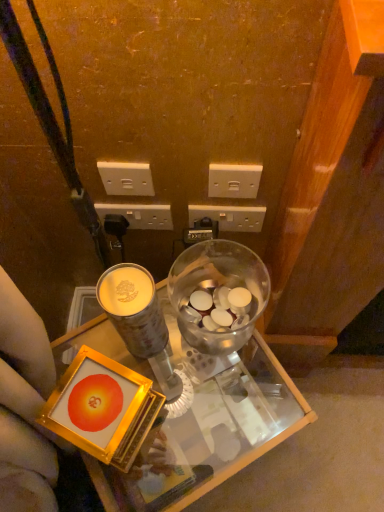
Question: Is white plastic power outlet at center, the second power outlet from the right, bigger than transparent glass desk at center?

Choices:
 (A) yes
 (B) no

Answer: (B)

Question: Considering the relative sizes of white plastic power outlet at center, which is the third power outlet from left to right, and transparent glass desk at center in the image provided, is white plastic power outlet at center, which is the third power outlet from left to right, smaller than transparent glass desk at center?

Choices:
 (A) no
 (B) yes

Answer: (B)

Question: Is white plastic power outlet at center, the second power outlet from the right, not inside transparent glass desk at center?

Choices:
 (A) no
 (B) yes

Answer: (B)

Question: Can you confirm if white plastic power outlet at center, which is the third power outlet from left to right, is positioned to the right of transparent glass desk at center?

Choices:
 (A) yes
 (B) no

Answer: (A)

Question: Is white plastic power outlet at center, which is the third power outlet from left to right, oriented towards transparent glass desk at center?

Choices:
 (A) yes
 (B) no

Answer: (B)

Question: From the image's perspective, relative to transparent glass desk at center, is white plastic power outlet at center, the third power outlet positioned from the right, above or below?

Choices:
 (A) below
 (B) above

Answer: (B)

Question: From a real-world perspective, is white plastic power outlet at center, the third power outlet positioned from the right, above or below transparent glass desk at center?

Choices:
 (A) above
 (B) below

Answer: (A)

Question: Is white plastic power outlet at center, the 2th power outlet viewed from the left, wider or thinner than transparent glass desk at center?

Choices:
 (A) wide
 (B) thin

Answer: (B)

Question: Is white plastic power outlet at center, the third power outlet positioned from the right, bigger or smaller than transparent glass desk at center?

Choices:
 (A) small
 (B) big

Answer: (A)

Question: Is white plastic power outlet at center, the second power outlet from the right, to the left or to the right of matte gold coffee cup at center in the image?

Choices:
 (A) right
 (B) left

Answer: (A)

Question: Which is correct: white plastic power outlet at center, the second power outlet from the right, is inside matte gold coffee cup at center, or outside of it?

Choices:
 (A) outside
 (B) inside

Answer: (A)

Question: From their relative heights in the image, would you say white plastic power outlet at center, which is the third power outlet from left to right, is taller or shorter than matte gold coffee cup at center?

Choices:
 (A) short
 (B) tall

Answer: (A)

Question: Considering the positions of point (233, 212) and point (144, 308), is point (233, 212) closer or farther from the camera than point (144, 308)?

Choices:
 (A) farther
 (B) closer

Answer: (A)

Question: Considering their positions, is white plastic power outlet at upper center, marked as the 1th power outlet in a left-to-right arrangement, located in front of or behind white plastic power outlet at center, the second power outlet from the right?

Choices:
 (A) behind
 (B) front

Answer: (B)

Question: From a real-world perspective, is white plastic power outlet at upper center, marked as the 1th power outlet in a left-to-right arrangement, physically located above or below white plastic power outlet at center, which is the third power outlet from left to right?

Choices:
 (A) below
 (B) above

Answer: (B)